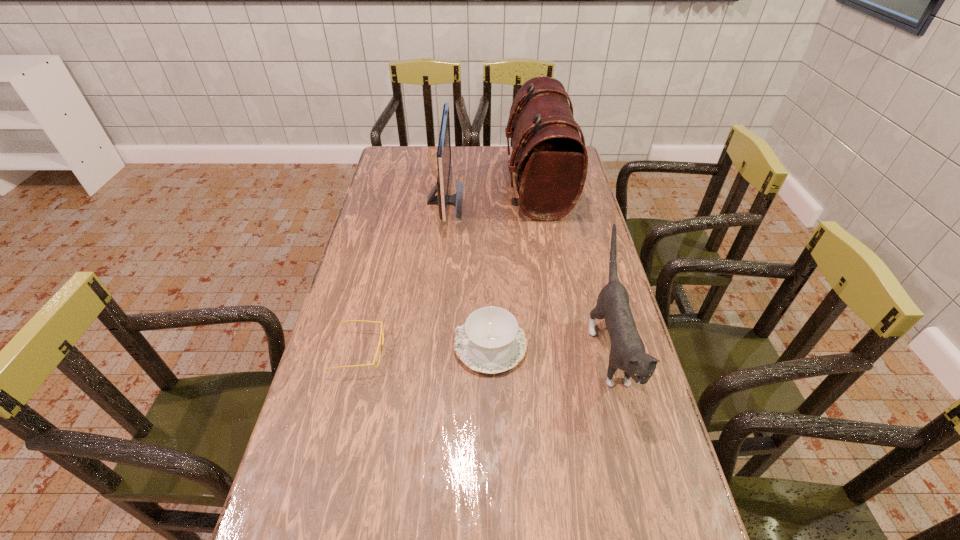
Where is `satchel`? satchel is located at coordinates (549, 158).

I want to click on monitor, so click(x=442, y=199).

The width and height of the screenshot is (960, 540). Find the location of `cat`. cat is located at coordinates (627, 353).

Identify the location of the fourth tallest object. The height and width of the screenshot is (540, 960). (491, 341).

Where is `the leftmost object`? the leftmost object is located at coordinates (380, 343).

Locate an element on the screen. the shortest object is located at coordinates (380, 343).

The image size is (960, 540). In order to click on vacant space located 0.260m on the front-facing side of the satchel in this screenshot , I will do `click(440, 185)`.

The width and height of the screenshot is (960, 540). Identify the location of vacant region located on the front-facing side of the satchel. (447, 185).

Identify the location of vacant space positioned 0.280m on the front-facing side of the satchel. This screenshot has height=540, width=960. (435, 185).

This screenshot has width=960, height=540. I want to click on vacant space situated on the screen side of the monitor, so pyautogui.click(x=565, y=201).